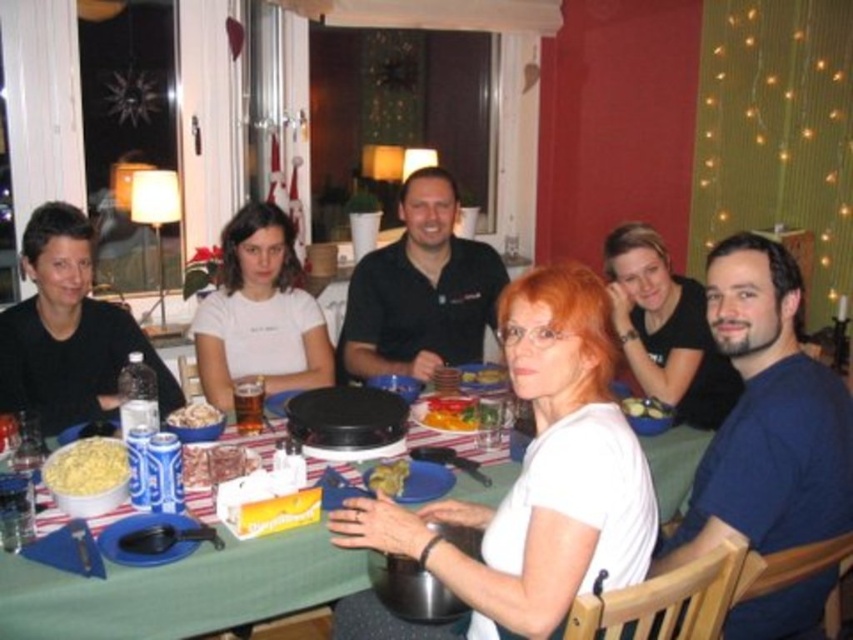
You are a guest at this table and want to place a small decorative item between the white matte shirt at center and the white crumbly bread at center. Which object should you place it closer to if you want the item to be near the taller object?

You should place the decorative item closer to the white matte shirt at center because it is taller than the white crumbly bread at center.